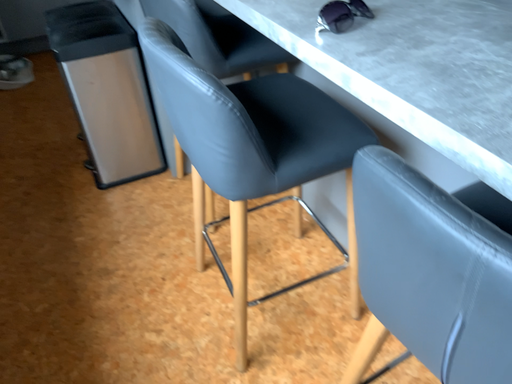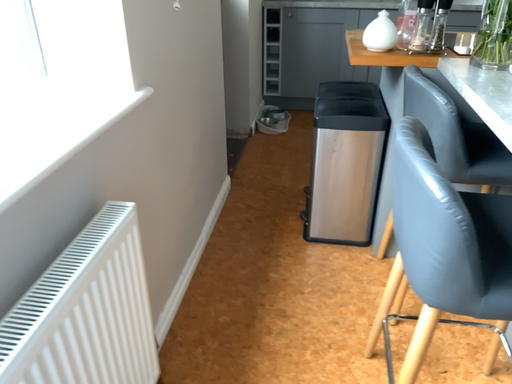
Question: Which way did the camera rotate in the video?

Choices:
 (A) rotated downward
 (B) rotated upward

Answer: (B)